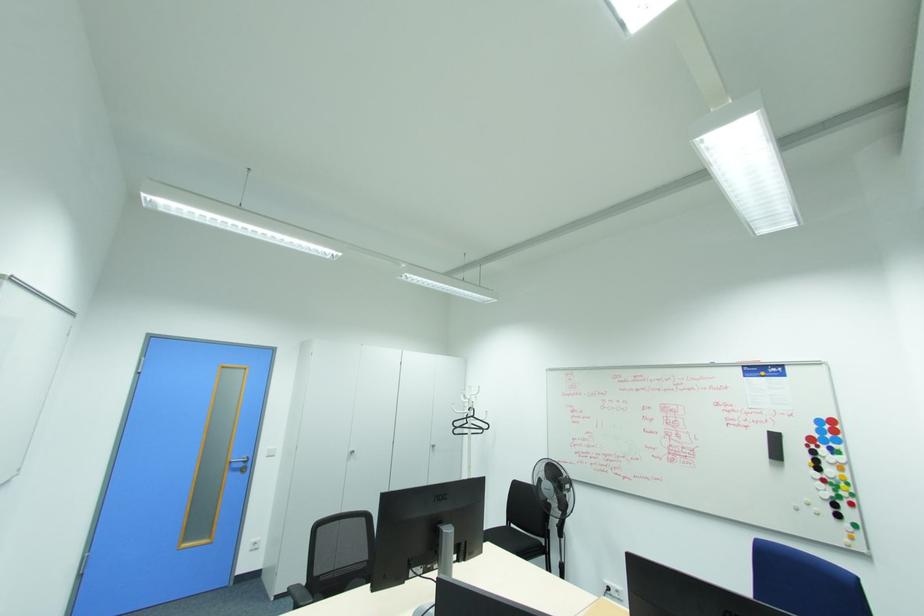
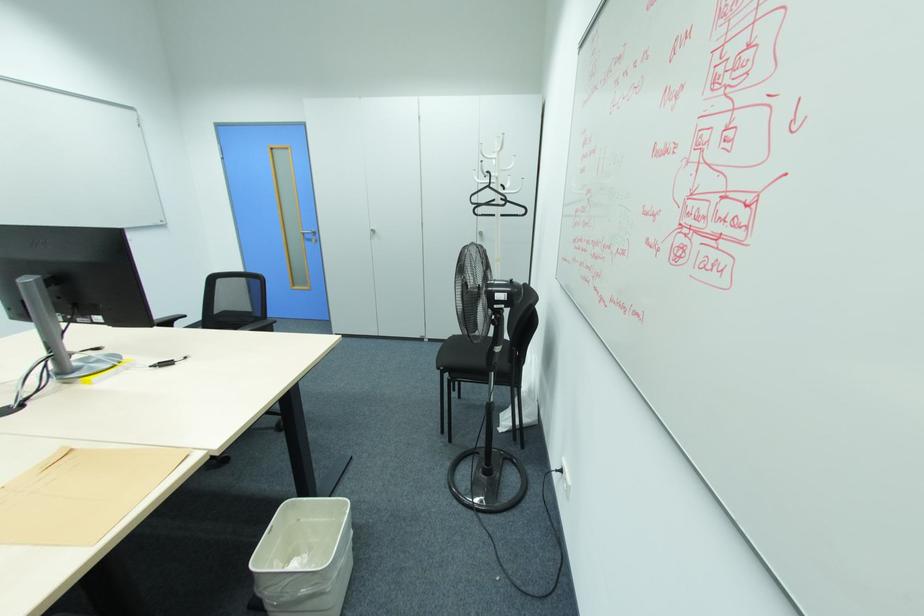
In the second image, find the point that corresponds to (473,416) in the first image.

(490, 187)